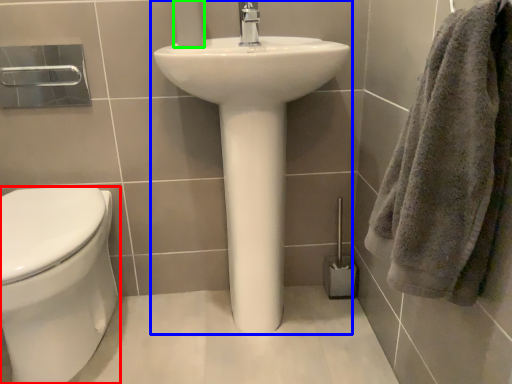
Question: Considering the real-world distances, which object is farthest from bidet (highlighted by a red box)? sink (highlighted by a blue box) or toilet paper (highlighted by a green box)?

Choices:
 (A) sink
 (B) toilet paper

Answer: (B)